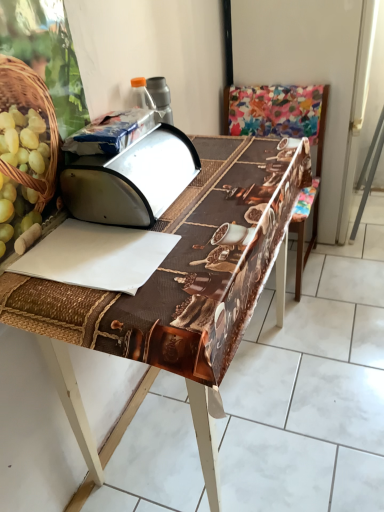
Identify the location of vacant area that is situated to the right of white paper at center, the first wrapping paper in the bottom-to-top sequence. The width and height of the screenshot is (384, 512). (198, 239).